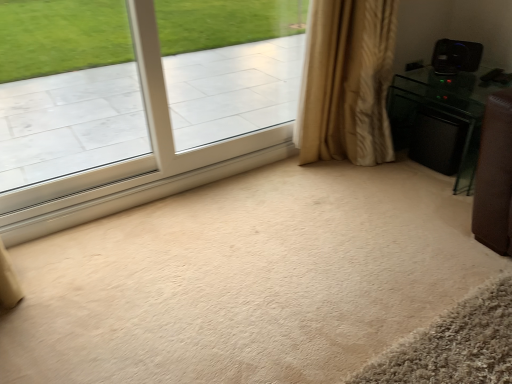
Question: Does black glossy speaker at right turn towards clear glass window at upper left?

Choices:
 (A) no
 (B) yes

Answer: (B)

Question: From the image's perspective, does black glossy speaker at right appear higher than clear glass window at upper left?

Choices:
 (A) no
 (B) yes

Answer: (A)

Question: Does black glossy speaker at right appear on the right side of clear glass window at upper left?

Choices:
 (A) yes
 (B) no

Answer: (A)

Question: Considering the relative sizes of black glossy speaker at right and clear glass window at upper left in the image provided, is black glossy speaker at right thinner than clear glass window at upper left?

Choices:
 (A) yes
 (B) no

Answer: (B)

Question: Does black glossy speaker at right have a greater width compared to clear glass window at upper left?

Choices:
 (A) no
 (B) yes

Answer: (B)

Question: From a real-world perspective, relative to black glossy speaker at right, is black plastic speaker at upper right vertically above or below?

Choices:
 (A) above
 (B) below

Answer: (A)

Question: Do you think black plastic speaker at upper right is within black glossy speaker at right, or outside of it?

Choices:
 (A) outside
 (B) inside

Answer: (A)

Question: Is black plastic speaker at upper right bigger or smaller than black glossy speaker at right?

Choices:
 (A) small
 (B) big

Answer: (A)

Question: Is black plastic speaker at upper right wider or thinner than black glossy speaker at right?

Choices:
 (A) thin
 (B) wide

Answer: (A)

Question: Is point (389, 89) positioned closer to the camera than point (477, 44)?

Choices:
 (A) farther
 (B) closer

Answer: (A)

Question: In terms of width, does black glossy speaker at right look wider or thinner when compared to black plastic speaker at upper right?

Choices:
 (A) wide
 (B) thin

Answer: (A)

Question: Visually, is black glossy speaker at right positioned to the left or to the right of black plastic speaker at upper right?

Choices:
 (A) left
 (B) right

Answer: (A)

Question: Considering the positions of black glossy speaker at right and black plastic speaker at upper right in the image, is black glossy speaker at right taller or shorter than black plastic speaker at upper right?

Choices:
 (A) tall
 (B) short

Answer: (A)

Question: From a real-world perspective, relative to black glossy speaker at right, is clear glass window at upper left vertically above or below?

Choices:
 (A) above
 (B) below

Answer: (A)

Question: Considering the positions of clear glass window at upper left and black glossy speaker at right in the image, is clear glass window at upper left taller or shorter than black glossy speaker at right?

Choices:
 (A) tall
 (B) short

Answer: (A)